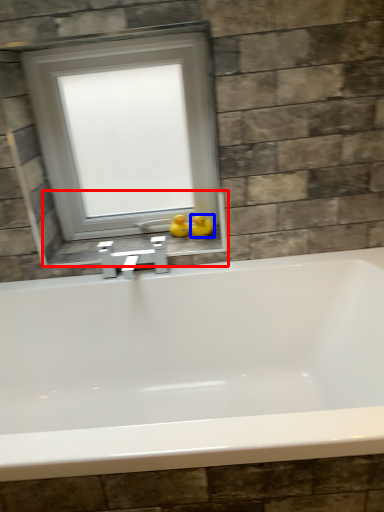
Question: Which point is closer to the camera, window sill (highlighted by a red box) or duck (highlighted by a blue box)?

Choices:
 (A) window sill
 (B) duck

Answer: (A)